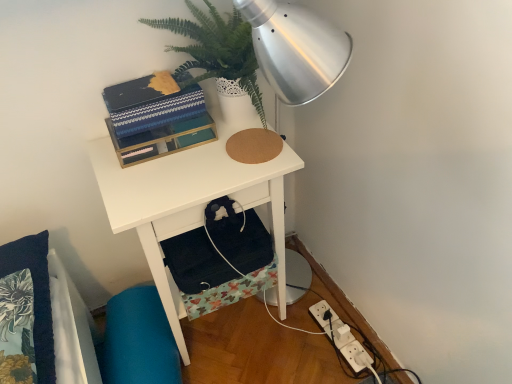
Question: Is point (122, 127) closer or farther from the camera than point (321, 311)?

Choices:
 (A) closer
 (B) farther

Answer: (A)

Question: Considering the positions of matte black book at upper center and white plastic power outlet at lower right in the image, is matte black book at upper center wider or thinner than white plastic power outlet at lower right?

Choices:
 (A) thin
 (B) wide

Answer: (A)

Question: Based on their relative distances, which object is nearer to the white plastic power outlet at lower right?

Choices:
 (A) matte black book at upper center
 (B) teal fabric swivel chair at lower left
 (C) green leafy plant at upper center
 (D) white matte desk at center

Answer: (D)

Question: Which object is positioned farthest from the matte black book at upper center?

Choices:
 (A) white plastic power outlet at lower right
 (B) green leafy plant at upper center
 (C) white matte desk at center
 (D) teal fabric swivel chair at lower left

Answer: (A)